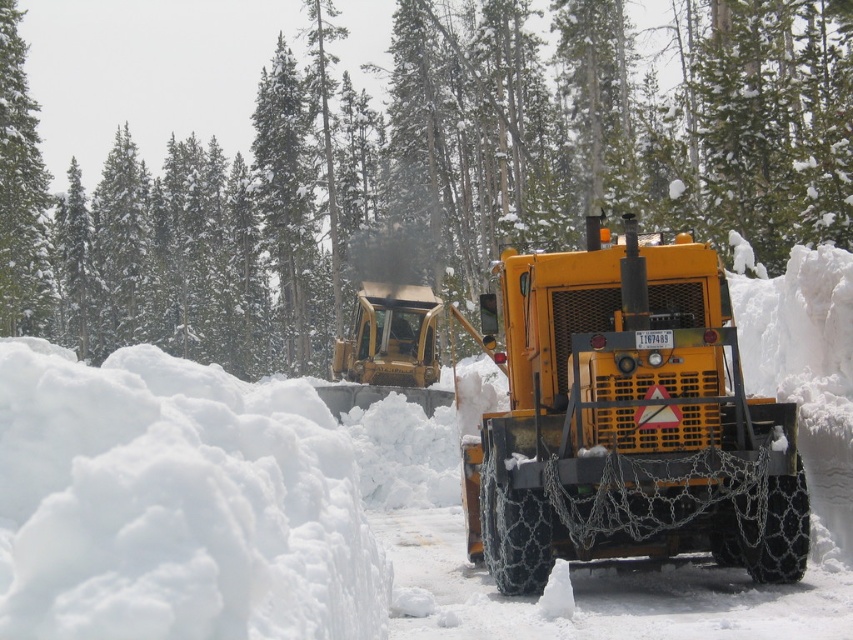
Question: Can you confirm if green textured tree at left is positioned above yellow metallic plow at center?

Choices:
 (A) no
 (B) yes

Answer: (B)

Question: Can you confirm if yellow metallic tractor at center is positioned to the left of green textured tree at left?

Choices:
 (A) yes
 (B) no

Answer: (B)

Question: Among these points, which one is nearest to the camera?

Choices:
 (A) (25, 248)
 (B) (618, 256)

Answer: (B)

Question: Which object is the farthest from the yellow metallic plow at center?

Choices:
 (A) green textured tree at center
 (B) green textured tree at left

Answer: (A)

Question: From the image, what is the correct spatial relationship of green textured tree at center in relation to yellow metallic tractor at center?

Choices:
 (A) right
 (B) left

Answer: (B)

Question: Among these objects, which one is nearest to the camera?

Choices:
 (A) green textured tree at left
 (B) green textured tree at center

Answer: (B)